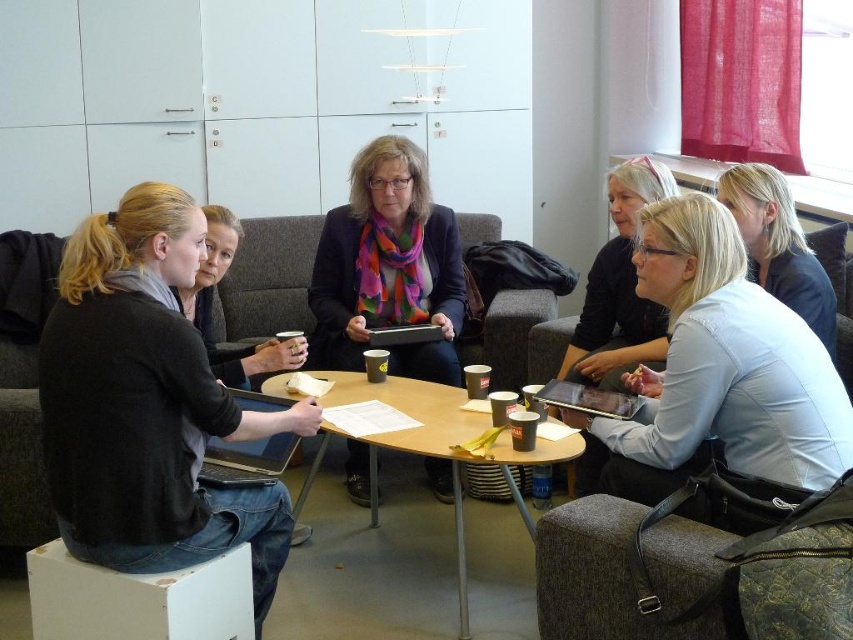
Can you confirm if blonde hair at upper right is positioned to the left of silver metallic laptop at center?

In fact, blonde hair at upper right is to the right of silver metallic laptop at center.

Who is more distant from viewer, (721, 177) or (270, 403)?

The point (721, 177) is more distant.

Where is `blonde hair at upper right`? This screenshot has height=640, width=853. blonde hair at upper right is located at coordinates (778, 244).

Is matte black jacket at center thinner than silver metallic laptop at center?

In fact, matte black jacket at center might be wider than silver metallic laptop at center.

You are a GUI agent. You are given a task and a screenshot of the screen. Output one action in this format:
    pyautogui.click(x=<x>, y=<y>)
    Task: Click on the matte black jacket at center
    This screenshot has height=640, width=853.
    Given the screenshot: What is the action you would take?
    pyautogui.click(x=387, y=268)

Measure the distance between light blue fabric shirt at center and camera.

light blue fabric shirt at center is 1.60 meters away from camera.

How much distance is there between light blue fabric shirt at center and blonde hair at upper right?

light blue fabric shirt at center is 21.76 inches from blonde hair at upper right.

The height and width of the screenshot is (640, 853). I want to click on light blue fabric shirt at center, so click(718, 371).